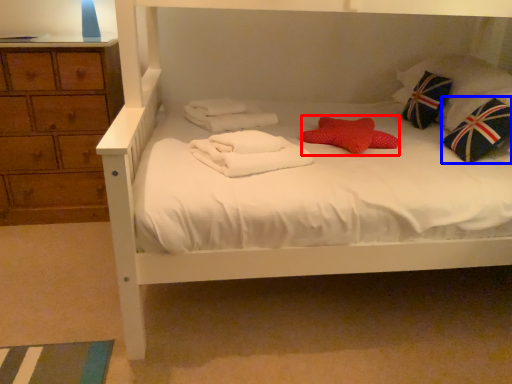
Question: Among these objects, which one is farthest to the camera, pillow (highlighted by a red box) or throw pillow (highlighted by a blue box)?

Choices:
 (A) pillow
 (B) throw pillow

Answer: (A)